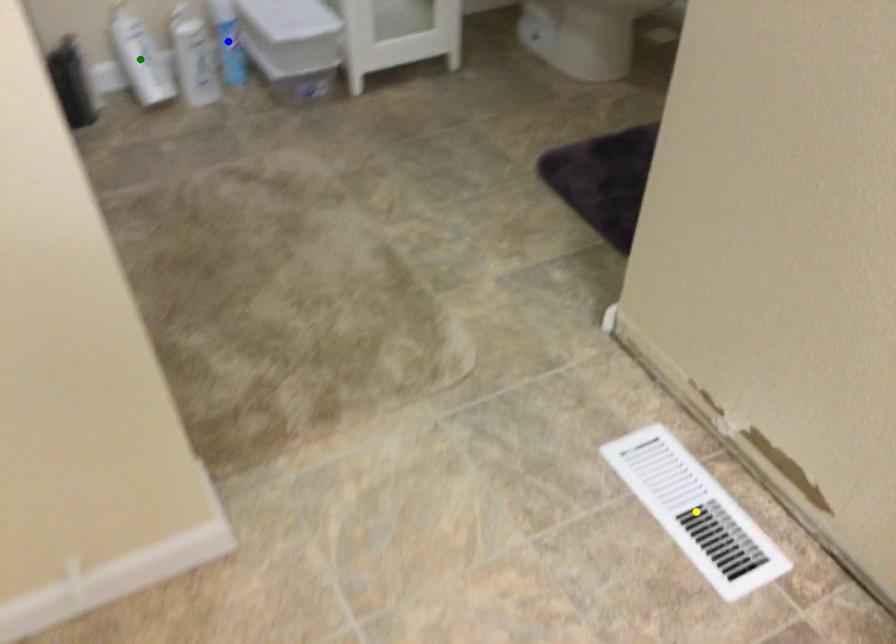
Order these from nearest to farthest:
- blue point
- yellow point
- green point

yellow point < green point < blue point